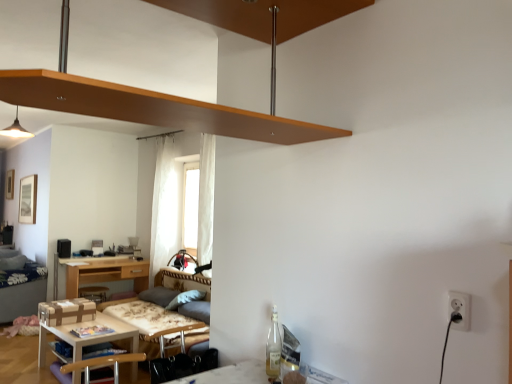
Question: Is white plastic electric outlet at lower right taller than brown wooden shelf at upper center?

Choices:
 (A) no
 (B) yes

Answer: (A)

Question: Is white plastic electric outlet at lower right turned away from brown wooden shelf at upper center?

Choices:
 (A) yes
 (B) no

Answer: (B)

Question: From the image's perspective, is white plastic electric outlet at lower right above brown wooden shelf at upper center?

Choices:
 (A) no
 (B) yes

Answer: (A)

Question: Is white plastic electric outlet at lower right outside brown wooden shelf at upper center?

Choices:
 (A) yes
 (B) no

Answer: (A)

Question: From a real-world perspective, is white plastic electric outlet at lower right under brown wooden shelf at upper center?

Choices:
 (A) no
 (B) yes

Answer: (B)

Question: From the image's perspective, does white plastic electric outlet at lower right appear lower than brown wooden shelf at upper center?

Choices:
 (A) yes
 (B) no

Answer: (A)

Question: Does white plastic electric outlet at lower right turn towards matte white pendant light at upper left?

Choices:
 (A) yes
 (B) no

Answer: (B)

Question: Is white plastic electric outlet at lower right thinner than matte white pendant light at upper left?

Choices:
 (A) yes
 (B) no

Answer: (A)

Question: Is the position of white plastic electric outlet at lower right more distant than that of matte white pendant light at upper left?

Choices:
 (A) no
 (B) yes

Answer: (A)

Question: Is white plastic electric outlet at lower right shorter than matte white pendant light at upper left?

Choices:
 (A) yes
 (B) no

Answer: (A)

Question: Does white plastic electric outlet at lower right appear on the right side of matte white pendant light at upper left?

Choices:
 (A) yes
 (B) no

Answer: (A)

Question: Is white plastic electric outlet at lower right taller than matte white pendant light at upper left?

Choices:
 (A) no
 (B) yes

Answer: (A)

Question: Is matte white pendant light at upper left positioned far away from wooden table at lower left?

Choices:
 (A) yes
 (B) no

Answer: (A)